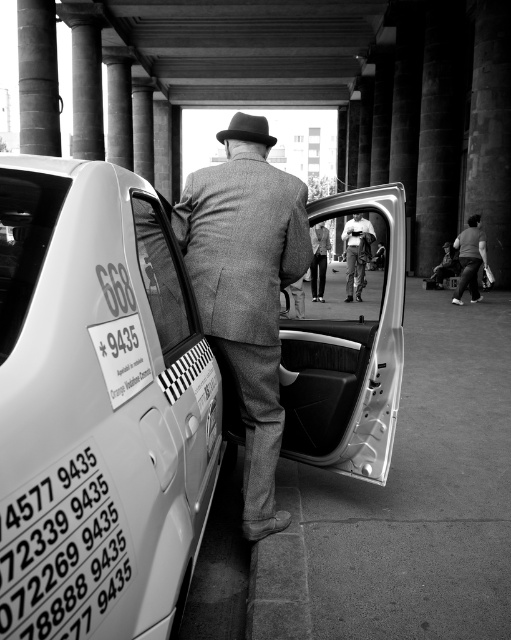
Question: Which point is farther from the camera taking this photo?

Choices:
 (A) (276, 278)
 (B) (390, 456)
 (C) (347, 228)

Answer: (C)

Question: Can you confirm if textured wool suit at center is thinner than metallic silver car door at center?

Choices:
 (A) no
 (B) yes

Answer: (A)

Question: Observing the image, what is the correct spatial positioning of denim pants at center in reference to matte gray fedora at center?

Choices:
 (A) above
 (B) below

Answer: (A)

Question: Which object is closer to the camera taking this photo?

Choices:
 (A) textured wool suit at center
 (B) white glossy taxi at center-left

Answer: (B)

Question: Considering the real-world distances, which object is closest to the textured wool suit at center?

Choices:
 (A) matte gray fedora at center
 (B) white glossy taxi at center-left
 (C) denim pants at center

Answer: (B)

Question: From the image, what is the correct spatial relationship of matte gray fedora at center in relation to light brown leather pants at center?

Choices:
 (A) left
 (B) right

Answer: (A)